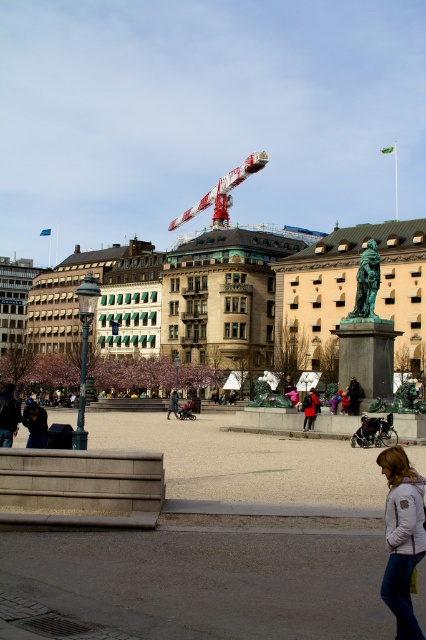
You are standing at the center of the urban square and want to take a photo of the statue. You notice a white fleece jacket at lower right and a camera. How far apart are these two items?

The white fleece jacket at lower right and the camera are 48.37 feet apart.

You are standing at the dark brown leather jacket at center in the urban square. You want to reach the white painted metal crane at upper center. Is the crane visible from your current position?

The white painted metal crane at upper center is 101.13 meters away from the dark brown leather jacket at center. Since the distance is quite large, the crane might be visible depending on the surrounding structures, but the description does not provide information about obstructions. However, based on typical urban square layouts, it is possible that the crane is visible from that distance unless there are buildings or other tall structures blocking the view. The scene mentions the crane is at upper center

In the scene shown: You are standing in the urban square and notice two people wearing dark blue jeans at lower left and matte black jacket at center. Which person is closer to you?

The dark blue jeans at lower left is positioned over matte black jacket at center, meaning it is closer to you.